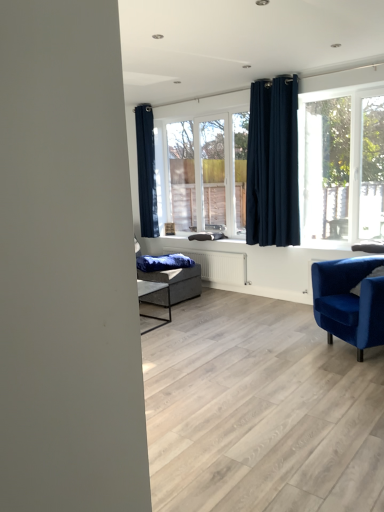
Question: In the image, is blue velvet blanket at center on the left side or the right side of dark blue fabric curtain at upper left, which ranks as the first curtain in back-to-front order?

Choices:
 (A) right
 (B) left

Answer: (A)

Question: Is blue velvet blanket at center wider or thinner than dark blue fabric curtain at upper left, arranged as the 2th curtain when viewed from the right?

Choices:
 (A) wide
 (B) thin

Answer: (A)

Question: Which object is positioned farthest from the dark blue velvet curtain at upper center, marked as the 1th curtain in a front-to-back arrangement?

Choices:
 (A) velvet blue armchair at lower right
 (B) blue velvet blanket at center
 (C) dark blue fabric curtain at upper left, arranged as the 1th curtain when viewed from the left
 (D) clear glass window at center

Answer: (C)

Question: Estimate the real-world distances between objects in this image. Which object is farther from the blue velvet blanket at center?

Choices:
 (A) dark blue fabric curtain at upper left, which appears as the second curtain when viewed from the front
 (B) velvet blue armchair at lower right
 (C) clear glass window at center
 (D) dark blue velvet curtain at upper center, the 2th curtain in the left-to-right sequence

Answer: (B)